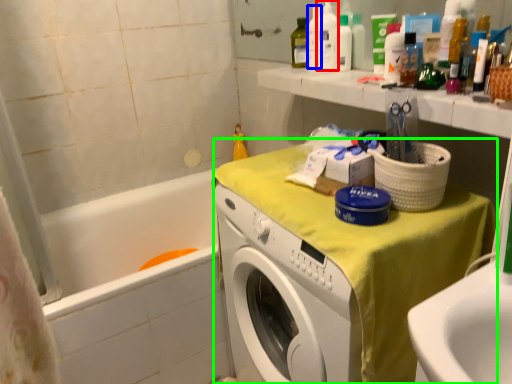
Question: Which object is positioned farthest from cleaning product (highlighted by a red box)? Select from bottle (highlighted by a blue box) and counter (highlighted by a green box).

Choices:
 (A) bottle
 (B) counter

Answer: (B)